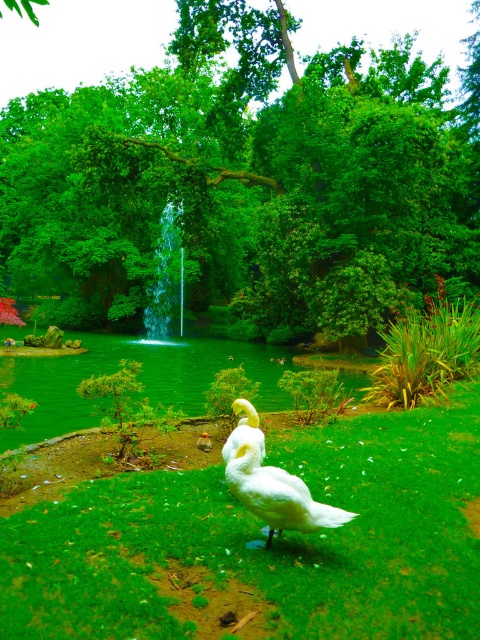
Locate an element on the screen. The width and height of the screenshot is (480, 640). green leafy tree at center is located at coordinates 248,179.

Is green leafy tree at center taller than white matte duck at center?

Yes.

Is point (278, 125) farther from camera compared to point (275, 496)?

Yes.

Locate an element on the screen. This screenshot has height=640, width=480. green leafy tree at center is located at coordinates (248, 179).

Is green glossy pond at center closer to camera compared to white matte duck at center?

No, it is behind white matte duck at center.

Describe the element at coordinates (139, 378) in the screenshot. The width and height of the screenshot is (480, 640). I see `green glossy pond at center` at that location.

This screenshot has width=480, height=640. I want to click on green glossy pond at center, so [139, 378].

What do you see at coordinates (248, 179) in the screenshot?
I see `green leafy tree at center` at bounding box center [248, 179].

Does point (455, 225) lie in front of point (311, 556)?

No, (455, 225) is behind (311, 556).

Is point (321, 285) closer to camera compared to point (50, 621)?

No, it is not.

The image size is (480, 640). What are the coordinates of `green leafy tree at center` in the screenshot? It's located at (248, 179).